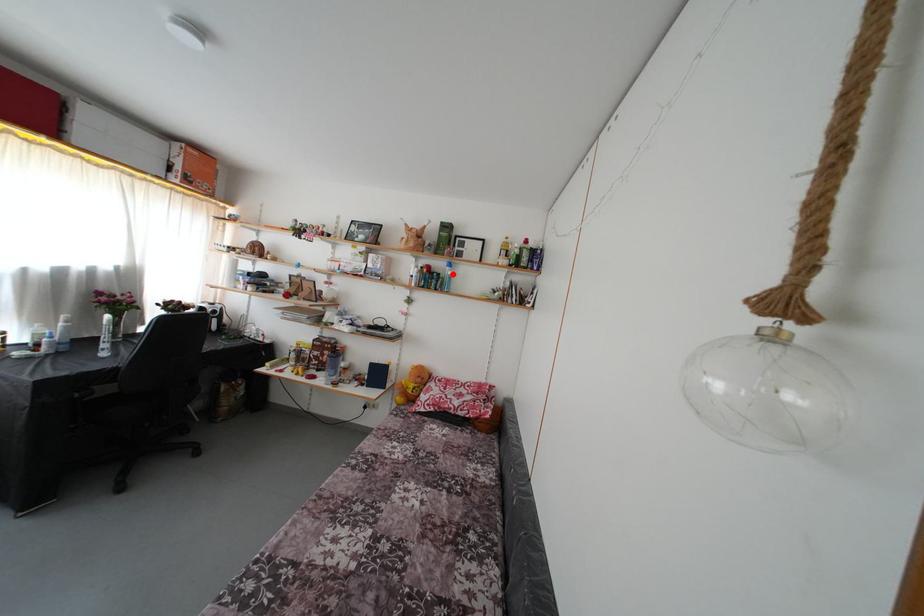
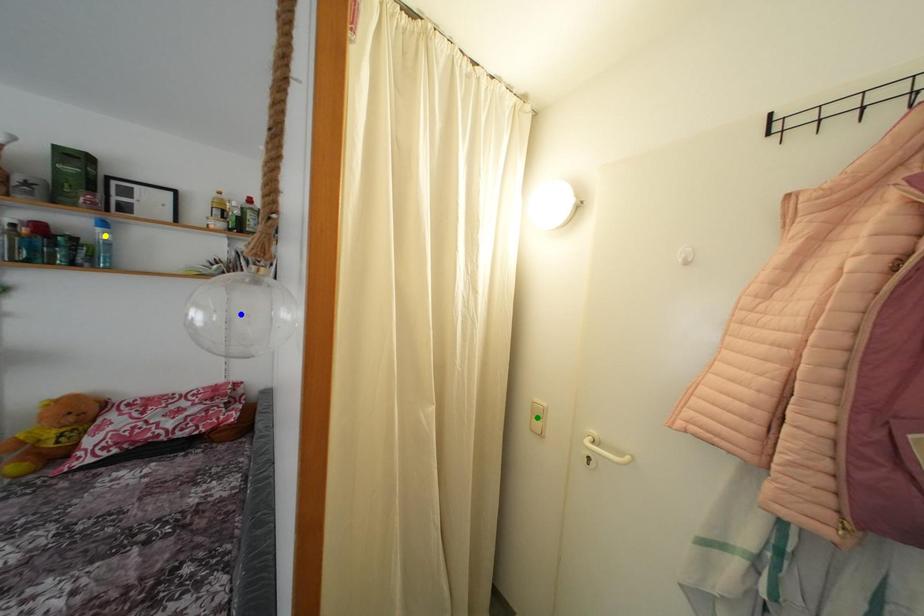
Question: I am providing you with two images of the same scene from different viewpoints. A red point is marked on the first image. You are given multiple points on the second image. Which spot in image 2 lines up with the point in image 1?

Choices:
 (A) green point
 (B) blue point
 (C) yellow point

Answer: (C)